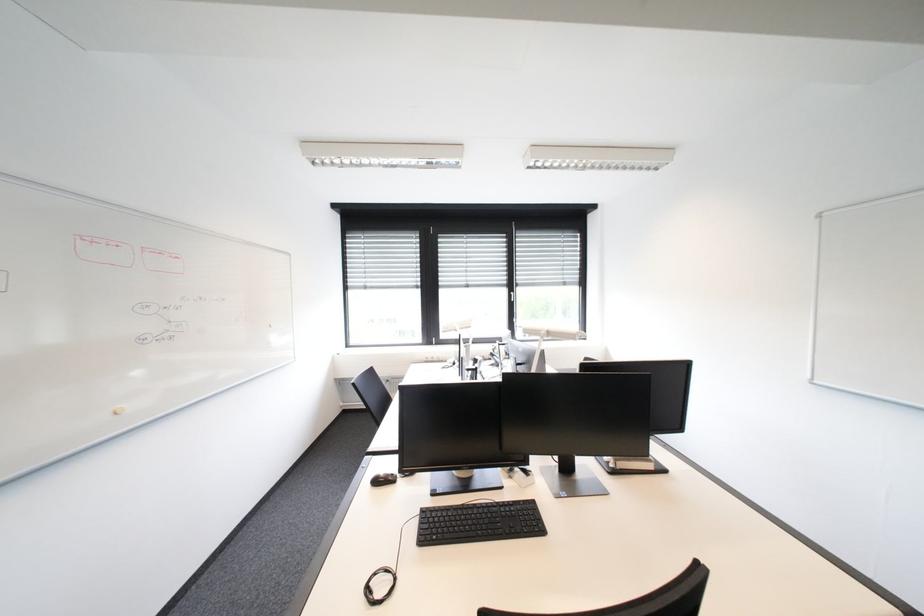
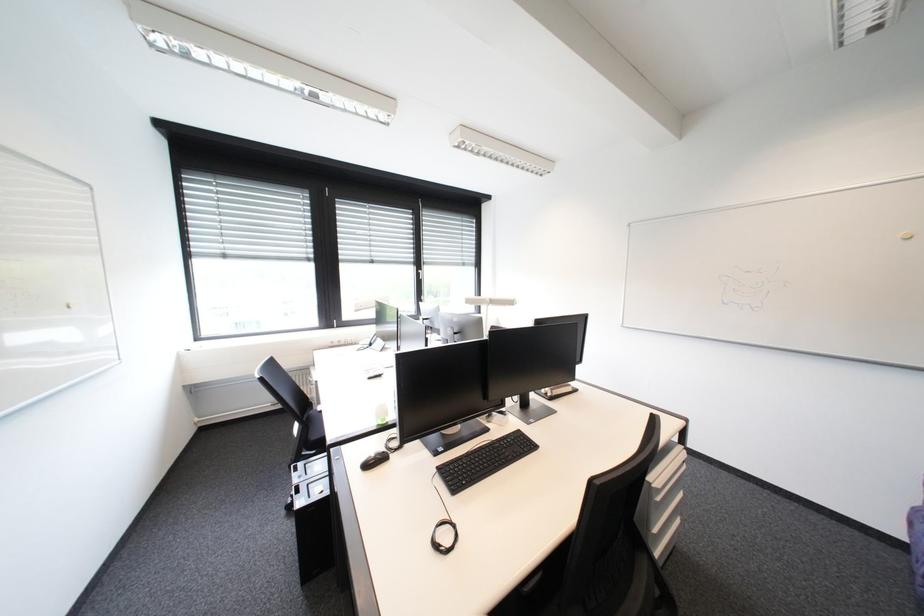
Question: The camera is either moving clockwise (left) or counter-clockwise (right) around the object. The first image is from the beginning of the video and the second image is from the end. Is the camera moving left or right when shooting the video?

Choices:
 (A) Left
 (B) Right

Answer: (A)